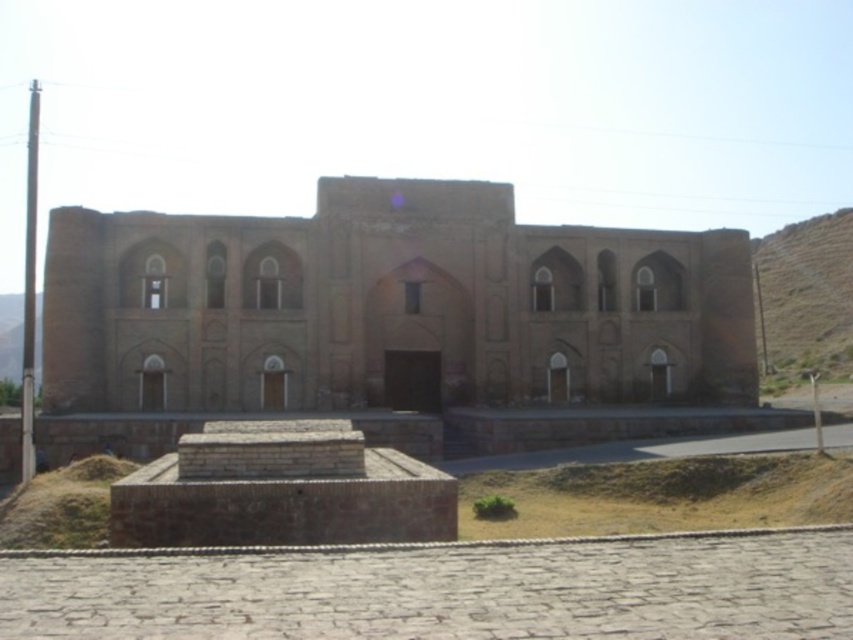
Question: Which point is closer to the camera?

Choices:
 (A) brown grass at lower left
 (B) brown rocky hill at right

Answer: (A)

Question: Considering the relative positions of brown rocky hill at right and brown grass at lower left in the image provided, where is brown rocky hill at right located with respect to brown grass at lower left?

Choices:
 (A) left
 (B) right

Answer: (B)

Question: Which object is closer to the camera taking this photo?

Choices:
 (A) brown rocky hill at right
 (B) brown grass at lower left

Answer: (B)

Question: Which object is farther from the camera taking this photo?

Choices:
 (A) brown grass at lower left
 (B) brown rocky hill at right

Answer: (B)

Question: Does brown rocky hill at right appear on the left side of brown grass at lower left?

Choices:
 (A) no
 (B) yes

Answer: (A)

Question: Does brown rocky hill at right appear over brown grass at lower left?

Choices:
 (A) no
 (B) yes

Answer: (B)